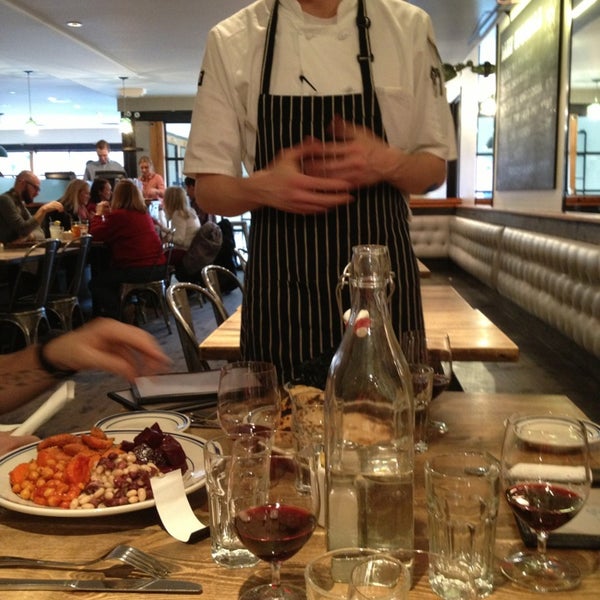
Where is `bottle of water`? Image resolution: width=600 pixels, height=600 pixels. bottle of water is located at coordinates (367, 458).